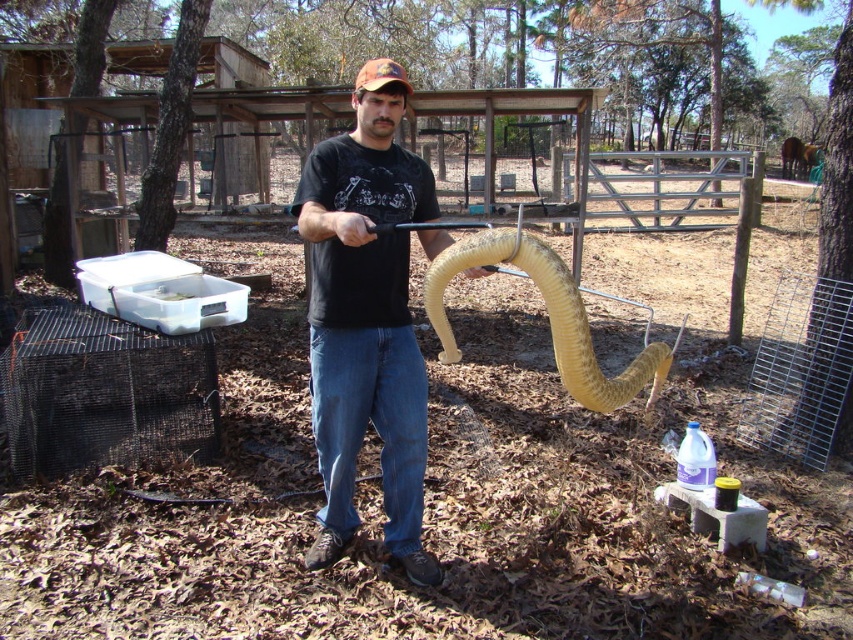
You are a farmer who needs to choose between the yellow rubber snake at center and the orange fabric baseball cap at center to place in a small storage box. Which object can fit better in the box?

The yellow rubber snake at center is smaller than the orange fabric baseball cap at center, so it can fit better in the small storage box.

You are a photographer trying to capture the man in the scene. If you want to focus on the black matte shirt at center, where should you aim your camera? Please provide coordinates in the format of x,y between 0 and 1.

The black matte shirt at center is located at coordinates [366,324], so you should aim your camera at that point to focus on it.